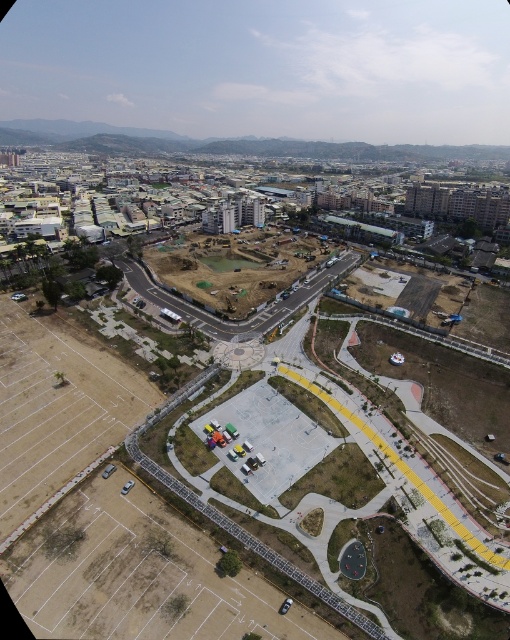
You are standing at the center of the basketball court and want to reach the point marked at coordinates [130,584]. What type of surface will you be walking on to get there?

The point marked at coordinates [130,584] is on concrete asphalt race track at lower left, so you will be walking on concrete asphalt race track to reach it.

You are a drone operator planning to fly a drone from the basketball court surrounded by a yellow safety barrier to the concrete asphalt race track at lower left. According to the coordinates provided, is the race track directly north of the basketball court?

The concrete asphalt race track at lower left is located at point (130, 584). Since the basketball court is in the foreground near the yellow barrier, and the race track is at lower left, the race track is not directly north but rather to the lower left direction from the basketball court.